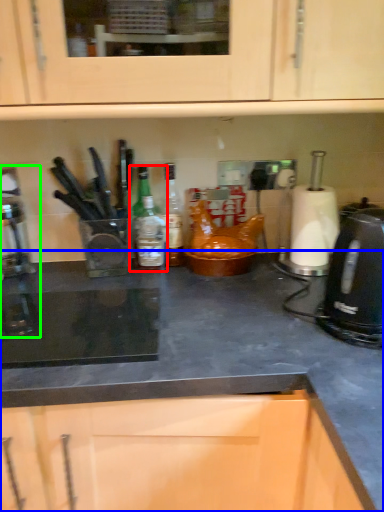
Question: Which object is the closest to the kitchen appliance (highlighted by a red box)? Choose among these: countertop (highlighted by a blue box) or coffee machine (highlighted by a green box).

Choices:
 (A) countertop
 (B) coffee machine

Answer: (A)